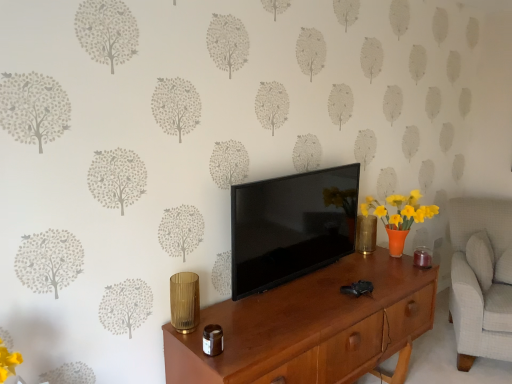
Question: From the image's perspective, is wooden desk at center over gold textured vase at center-right?

Choices:
 (A) yes
 (B) no

Answer: (B)

Question: Is wooden desk at center located outside gold textured vase at center-right?

Choices:
 (A) yes
 (B) no

Answer: (A)

Question: Can you confirm if wooden desk at center is taller than gold textured vase at center-right?

Choices:
 (A) no
 (B) yes

Answer: (B)

Question: From the image's perspective, is wooden desk at center beneath gold textured vase at center-right?

Choices:
 (A) no
 (B) yes

Answer: (B)

Question: From a real-world perspective, is wooden desk at center on gold textured vase at center-right?

Choices:
 (A) no
 (B) yes

Answer: (A)

Question: Considering their positions, is gold textured vase at center-right located in front of or behind black glossy tv at center?

Choices:
 (A) behind
 (B) front

Answer: (A)

Question: Considering the positions of point (355, 238) and point (273, 253), is point (355, 238) closer or farther from the camera than point (273, 253)?

Choices:
 (A) farther
 (B) closer

Answer: (A)

Question: Is gold textured vase at center-right taller or shorter than black glossy tv at center?

Choices:
 (A) short
 (B) tall

Answer: (A)

Question: From the image's perspective, is gold textured vase at center-right positioned above or below black glossy tv at center?

Choices:
 (A) below
 (B) above

Answer: (A)

Question: Is black glossy tv at center to the left or to the right of wooden desk at center in the image?

Choices:
 (A) right
 (B) left

Answer: (B)

Question: In terms of width, does black glossy tv at center look wider or thinner when compared to wooden desk at center?

Choices:
 (A) wide
 (B) thin

Answer: (B)

Question: From a real-world perspective, is black glossy tv at center above or below wooden desk at center?

Choices:
 (A) below
 (B) above

Answer: (B)

Question: Is black glossy tv at center bigger or smaller than wooden desk at center?

Choices:
 (A) small
 (B) big

Answer: (A)

Question: From a real-world perspective, is gold textured vase at center-right above or below wooden desk at center?

Choices:
 (A) above
 (B) below

Answer: (A)

Question: Relative to wooden desk at center, is gold textured vase at center-right in front or behind?

Choices:
 (A) behind
 (B) front

Answer: (A)